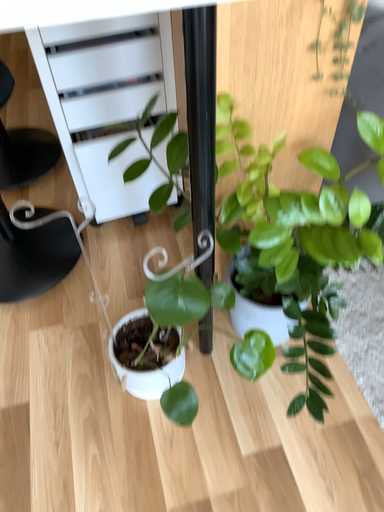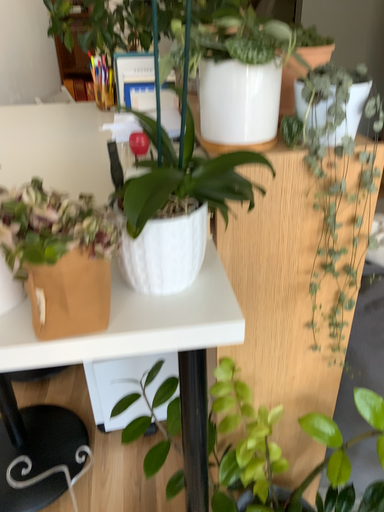
Question: How did the camera likely rotate when shooting the video?

Choices:
 (A) rotated upward
 (B) rotated downward

Answer: (A)